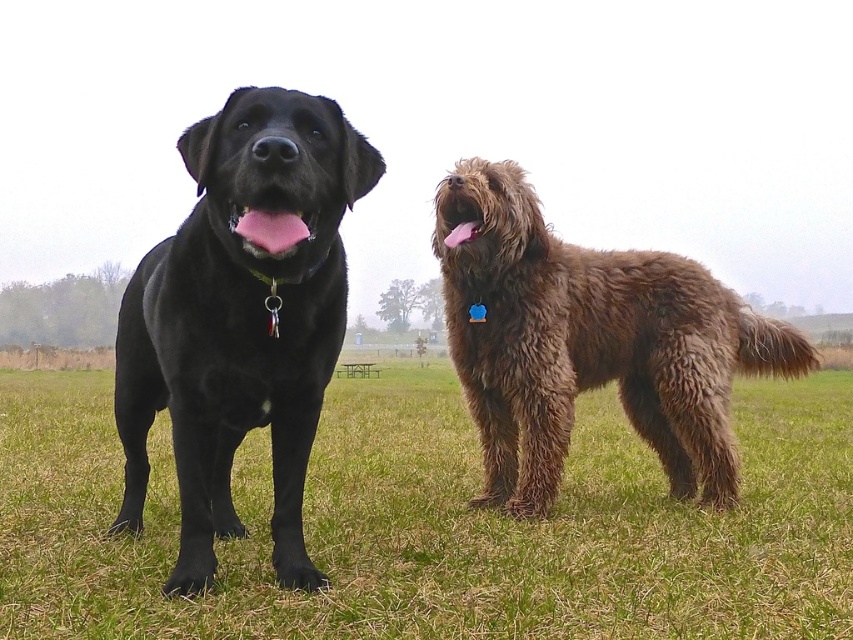
Question: Which point is farther to the camera?

Choices:
 (A) click(448, 266)
 (B) click(657, 529)
 (C) click(235, 396)

Answer: (A)

Question: Which of the following is the closest to the observer?

Choices:
 (A) (291, 497)
 (B) (619, 384)
 (C) (636, 545)

Answer: (A)

Question: Is green grass at lower center bigger than fuzzy brown dog at right?

Choices:
 (A) no
 (B) yes

Answer: (B)

Question: Can you confirm if green grass at lower center is smaller than matte black dog at left?

Choices:
 (A) no
 (B) yes

Answer: (A)

Question: Which point is farther from the camera taking this photo?

Choices:
 (A) (619, 426)
 (B) (190, 536)

Answer: (A)

Question: Is matte black dog at left in front of fuzzy brown dog at right?

Choices:
 (A) no
 (B) yes

Answer: (B)